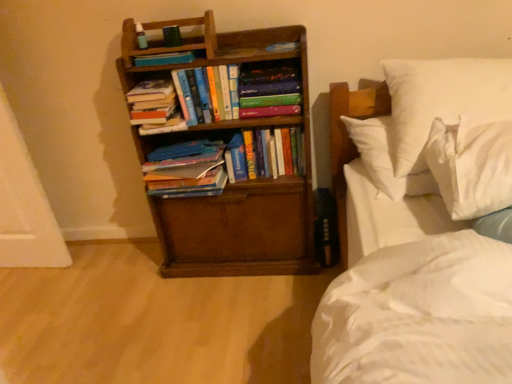
Question: Based on their positions, is white soft pillow at upper right, the 2th pillow from the front, located to the left or right of hardcover book at center, which is the 5th book from left to right?

Choices:
 (A) left
 (B) right

Answer: (B)

Question: From their relative heights in the image, would you say white soft pillow at upper right, the first pillow in the back-to-front sequence, is taller or shorter than hardcover book at center, which is the 5th book from left to right?

Choices:
 (A) tall
 (B) short

Answer: (A)

Question: Which is nearer to the hardcover book at center, which is the 5th book from left to right?

Choices:
 (A) hardcover book at center, marked as the second book in a left-to-right arrangement
 (B) hardcover books at center, the 2th book positioned from the right
 (C) brown wooden bookcase at left
 (D) white soft pillow at upper right, which appears as the second pillow when viewed from the back
 (E) white soft pillow at upper right, the first pillow in the back-to-front sequence

Answer: (B)

Question: Which is farther from the white soft pillow at upper right, which appears as the second pillow when viewed from the back?

Choices:
 (A) hardcover book at center, arranged as the 1th book when viewed from the right
 (B) brown wooden bookcase at left
 (C) hardcover books at center, which ranks as the 3th book in right-to-left order
 (D) hardcover book at center, marked as the second book in a left-to-right arrangement
 (E) hardcover books at left, the 5th book positioned from the right

Answer: (D)